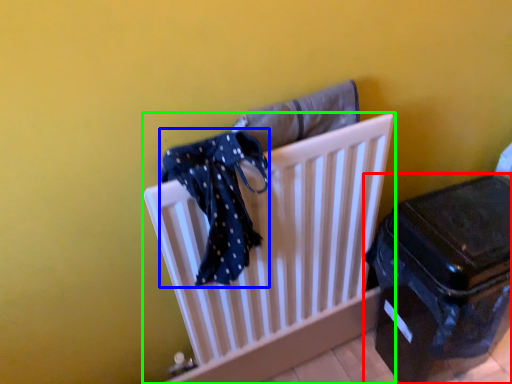
Question: Estimate the real-world distances between objects in this image. Which object is closer to suitcase (highlighted by a red box), scarf (highlighted by a blue box) or furniture (highlighted by a green box)?

Choices:
 (A) scarf
 (B) furniture

Answer: (B)